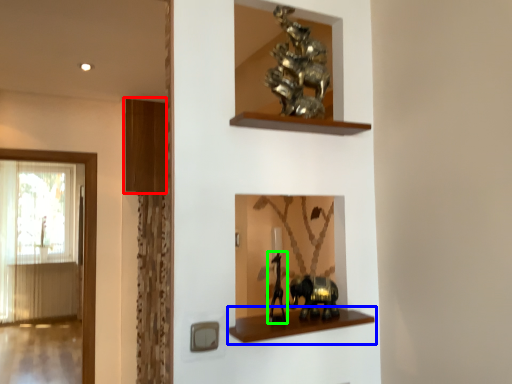
Question: Based on their relative distances, which object is farther from shelf (highlighted by a red box)? Choose from shelf (highlighted by a blue box) and animal (highlighted by a green box).

Choices:
 (A) shelf
 (B) animal

Answer: (A)